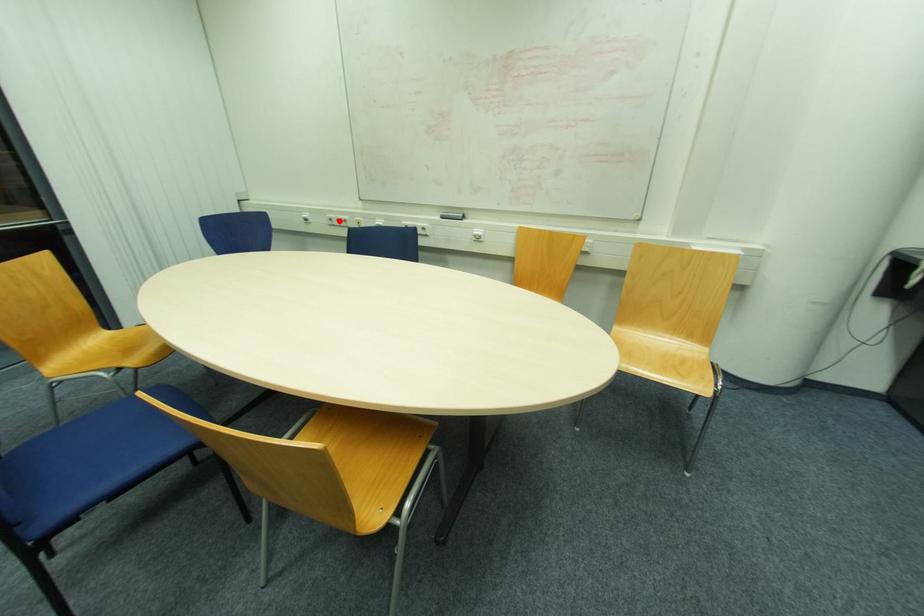
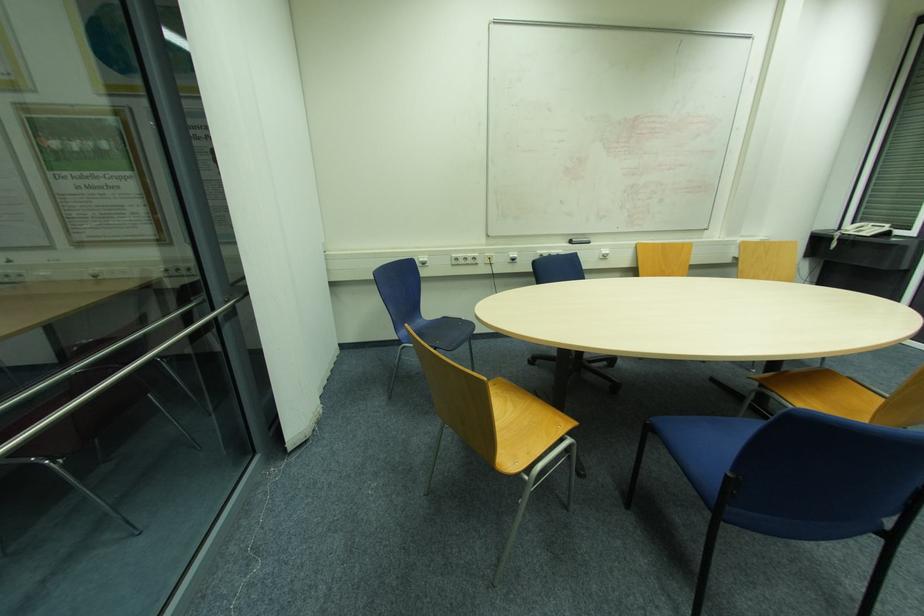
Where in the second image is the point corresponding to the highlighted location from the first image?

(467, 259)